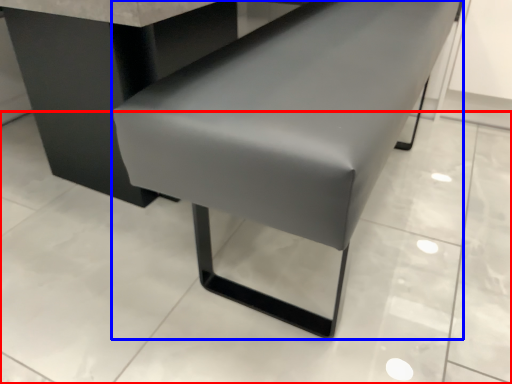
Question: Which object is closer to the camera taking this photo, concrete (highlighted by a red box) or furniture (highlighted by a blue box)?

Choices:
 (A) concrete
 (B) furniture

Answer: (B)